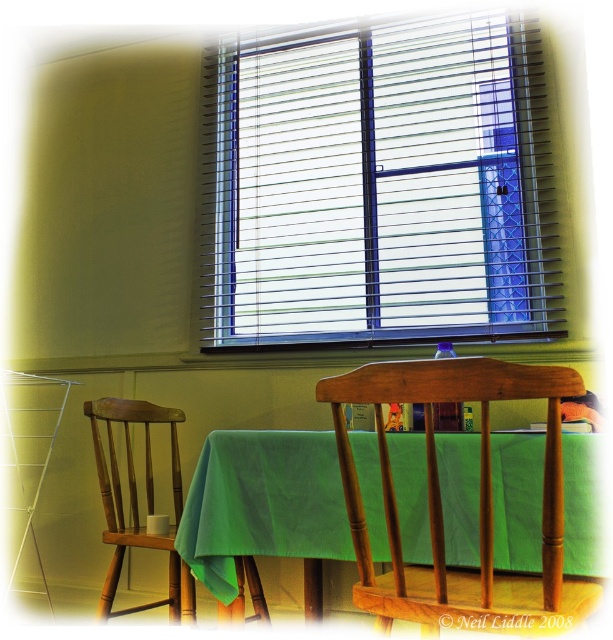
Can you confirm if wooden chair at center is smaller than wooden chair at left?

Yes.

I want to click on wooden chair at center, so click(x=441, y=509).

The image size is (613, 640). I want to click on wooden chair at center, so click(441, 509).

Does white plastic blinds at upper center appear on the left side of wooden chair at center?

Yes, white plastic blinds at upper center is to the left of wooden chair at center.

Is white plastic blinds at upper center above wooden chair at center?

Yes, white plastic blinds at upper center is above wooden chair at center.

Does point (229, 225) come in front of point (546, 560)?

That is False.

Identify the location of white plastic blinds at upper center. (378, 186).

Between green fabric tablecloth at center and wooden chair at center, which one has more height?

Standing taller between the two is wooden chair at center.

Can you confirm if green fabric tablecloth at center is wider than wooden chair at center?

Indeed, green fabric tablecloth at center has a greater width compared to wooden chair at center.

Who is more distant from viewer, (402,451) or (446,570)?

Point (402,451)

What are the coordinates of `green fabric tablecloth at center` in the screenshot? It's located at (262, 502).